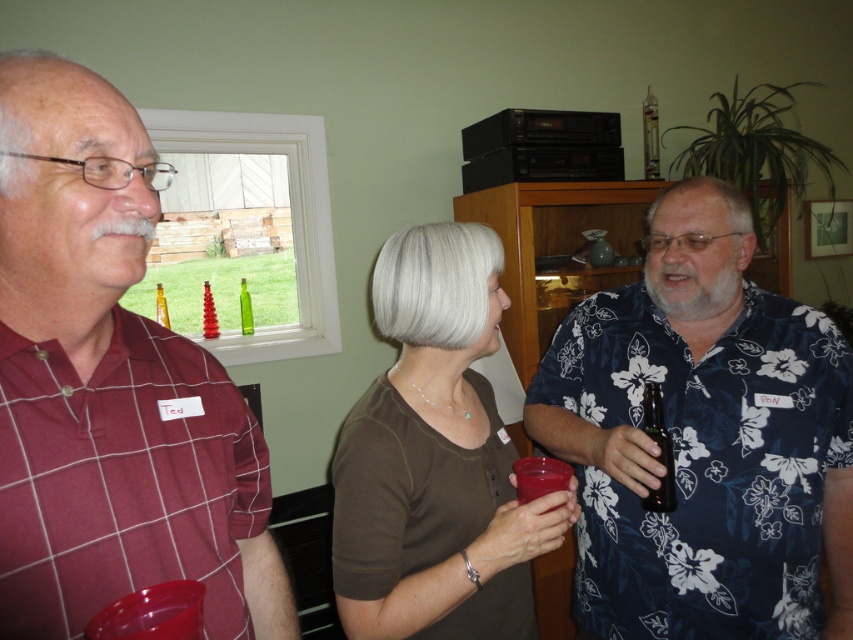
Question: Which point appears closest to the camera in this image?

Choices:
 (A) (166, 324)
 (B) (245, 291)
 (C) (51, 508)

Answer: (C)

Question: Is black glass bottle at right to the right of translucent glass bottle at center from the viewer's perspective?

Choices:
 (A) yes
 (B) no

Answer: (A)

Question: Does translucent glass bottle at center have a smaller size compared to green glass bottle at center?

Choices:
 (A) no
 (B) yes

Answer: (B)

Question: Which point is closer to the camera taking this photo?

Choices:
 (A) (668, 454)
 (B) (659, 170)
 (C) (242, 324)

Answer: (A)

Question: Where is black glass bottle at right located in relation to green glass bottle at center in the image?

Choices:
 (A) below
 (B) above

Answer: (A)

Question: Which point is closer to the camera taking this photo?

Choices:
 (A) click(161, 320)
 (B) click(373, 433)

Answer: (B)